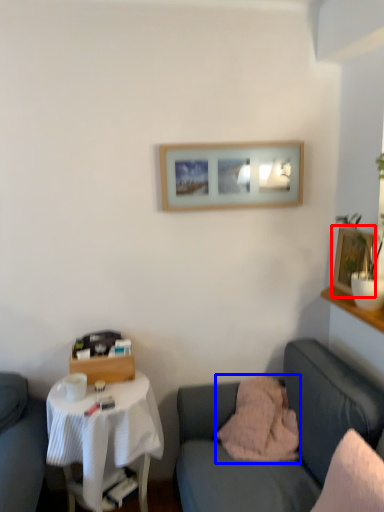
Question: Which of the following is the farthest to the observer, picture frame (highlighted by a red box) or pillow (highlighted by a blue box)?

Choices:
 (A) picture frame
 (B) pillow

Answer: (A)